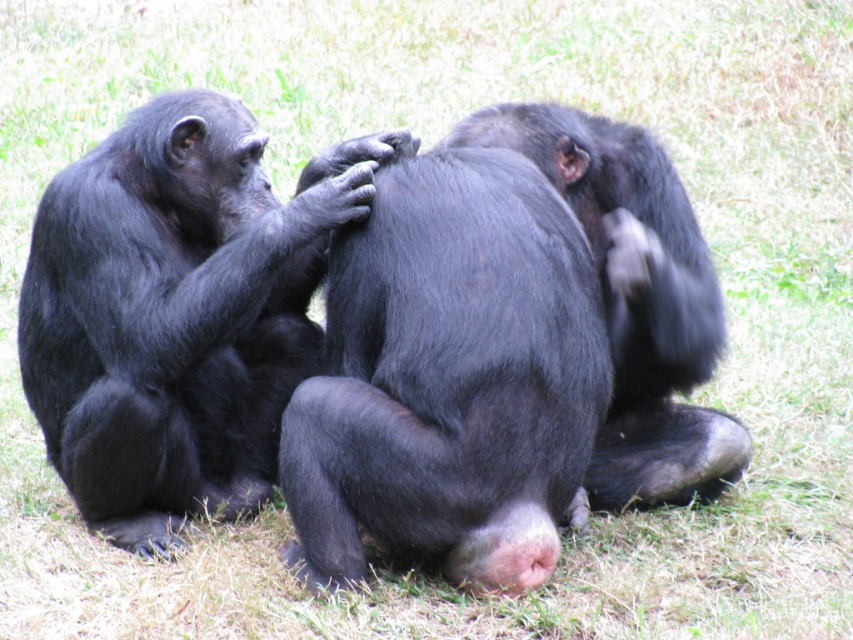
Question: Is black matte fur at center to the left of shiny black fur at center from the viewer's perspective?

Choices:
 (A) no
 (B) yes

Answer: (B)

Question: Which point is farther to the camera?

Choices:
 (A) shiny black fur at center
 (B) black matte fur at center

Answer: (A)

Question: Does black matte fur at center have a smaller size compared to shiny black monkey at center?

Choices:
 (A) no
 (B) yes

Answer: (B)

Question: Does shiny black monkey at center have a smaller size compared to shiny black fur at center?

Choices:
 (A) yes
 (B) no

Answer: (B)

Question: Which object is farther from the camera taking this photo?

Choices:
 (A) shiny black monkey at center
 (B) shiny black fur at center
 (C) black matte fur at center

Answer: (A)

Question: Which object is closer to the camera taking this photo?

Choices:
 (A) black matte fur at center
 (B) shiny black monkey at center

Answer: (A)